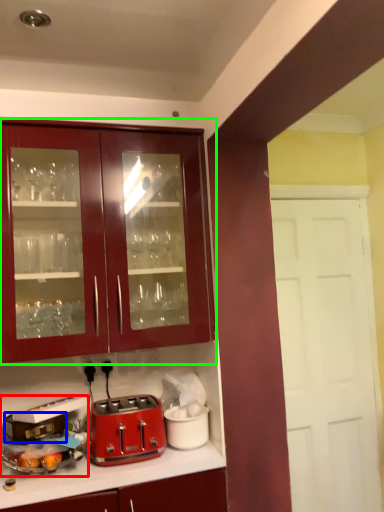
Question: Estimate the real-world distances between objects in this image. Which object is farther from appliance (highlighted by a red box), appliance (highlighted by a blue box) or cabinetry (highlighted by a green box)?

Choices:
 (A) appliance
 (B) cabinetry

Answer: (B)